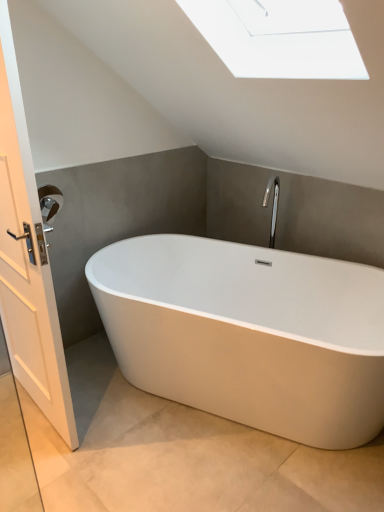
Question: Can you confirm if brushed metal towel bar at left is positioned to the left of white glossy bathtub at center?

Choices:
 (A) yes
 (B) no

Answer: (A)

Question: Is brushed metal towel bar at left looking in the opposite direction of white glossy bathtub at center?

Choices:
 (A) no
 (B) yes

Answer: (A)

Question: From the image's perspective, is brushed metal towel bar at left located beneath white glossy bathtub at center?

Choices:
 (A) yes
 (B) no

Answer: (B)

Question: From a real-world perspective, is brushed metal towel bar at left located beneath white glossy bathtub at center?

Choices:
 (A) no
 (B) yes

Answer: (A)

Question: From a real-world perspective, is brushed metal towel bar at left physically above white glossy bathtub at center?

Choices:
 (A) no
 (B) yes

Answer: (B)

Question: Can you confirm if brushed metal towel bar at left is positioned to the right of white glossy bathtub at center?

Choices:
 (A) no
 (B) yes

Answer: (A)

Question: Is the surface of white wooden door at left in direct contact with white glossy bathtub at center?

Choices:
 (A) no
 (B) yes

Answer: (A)

Question: Is white wooden door at left positioned beyond the bounds of white glossy bathtub at center?

Choices:
 (A) yes
 (B) no

Answer: (A)

Question: Is white wooden door at left facing away from white glossy bathtub at center?

Choices:
 (A) yes
 (B) no

Answer: (A)

Question: Is white glossy bathtub at center inside white wooden door at left?

Choices:
 (A) yes
 (B) no

Answer: (B)

Question: Is white wooden door at left thinner than white glossy bathtub at center?

Choices:
 (A) no
 (B) yes

Answer: (B)

Question: Does white wooden door at left have a larger size compared to white glossy bathtub at center?

Choices:
 (A) yes
 (B) no

Answer: (B)

Question: Is white glossy bathtub at center outside white wooden door at left?

Choices:
 (A) no
 (B) yes

Answer: (B)